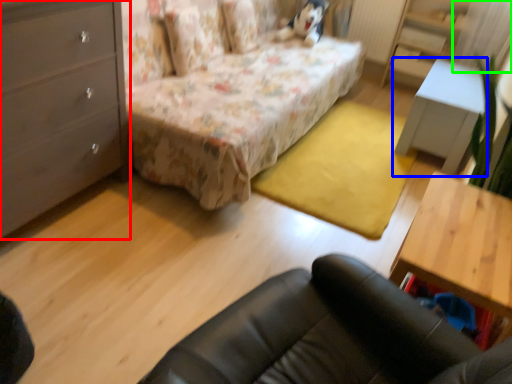
Question: Based on their relative distances, which object is farther from chest of drawers (highlighted by a red box)? Choose from table (highlighted by a blue box) and curtain (highlighted by a green box).

Choices:
 (A) table
 (B) curtain

Answer: (B)